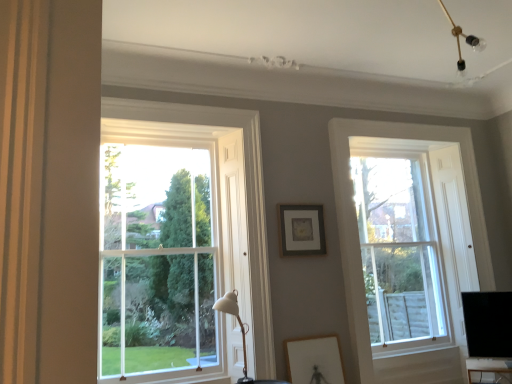
Question: Considering the relative positions of clear glass window at right, the first window positioned from the back, and clear glass window at left, which appears as the 2th window when viewed from the right, in the image provided, is clear glass window at right, the first window positioned from the back, to the right of clear glass window at left, which appears as the 2th window when viewed from the right, from the viewer's perspective?

Choices:
 (A) no
 (B) yes

Answer: (B)

Question: Considering the relative sizes of clear glass window at right, which is the 2th window in front-to-back order, and clear glass window at left, which appears as the 2th window when viewed from the right, in the image provided, is clear glass window at right, which is the 2th window in front-to-back order, shorter than clear glass window at left, which appears as the 2th window when viewed from the right,?

Choices:
 (A) yes
 (B) no

Answer: (B)

Question: Is the depth of clear glass window at right, the 1th window in the right-to-left sequence, less than that of clear glass window at left, which appears as the 2th window when viewed from the right?

Choices:
 (A) yes
 (B) no

Answer: (B)

Question: Is the depth of clear glass window at right, the first window positioned from the back, greater than that of clear glass window at left, which appears as the 2th window when viewed from the right?

Choices:
 (A) yes
 (B) no

Answer: (A)

Question: Is clear glass window at right, which is the 2th window in front-to-back order, oriented away from clear glass window at left, which is the first window in front-to-back order?

Choices:
 (A) yes
 (B) no

Answer: (B)

Question: Is clear glass window at left, which appears as the first window when viewed from the left, inside clear glass window at right, which is the 2th window in front-to-back order?

Choices:
 (A) no
 (B) yes

Answer: (A)

Question: From a real-world perspective, is clear glass window at left, positioned as the 2th window in back-to-front order, physically above matte black picture frame at center, the first picture frame in the top-to-bottom sequence?

Choices:
 (A) no
 (B) yes

Answer: (A)

Question: Does clear glass window at left, which appears as the 2th window when viewed from the right, have a greater width compared to matte black picture frame at center, marked as the second picture frame in a front-to-back arrangement?

Choices:
 (A) yes
 (B) no

Answer: (A)

Question: Is clear glass window at left, which appears as the first window when viewed from the left, aimed at matte black picture frame at center, the first picture frame positioned from the back?

Choices:
 (A) yes
 (B) no

Answer: (B)

Question: Does clear glass window at left, which appears as the first window when viewed from the left, have a lesser height compared to matte black picture frame at center, marked as the second picture frame in a front-to-back arrangement?

Choices:
 (A) no
 (B) yes

Answer: (A)

Question: From the image's perspective, is clear glass window at left, which appears as the 2th window when viewed from the right, over matte black picture frame at center, marked as the second picture frame in a front-to-back arrangement?

Choices:
 (A) no
 (B) yes

Answer: (A)

Question: Can you confirm if clear glass window at left, which appears as the 2th window when viewed from the right, is positioned to the right of matte black picture frame at center, the first picture frame positioned from the back?

Choices:
 (A) no
 (B) yes

Answer: (A)

Question: Is black glossy monitor at lower right to the left of wooden framed picture at lower center, the 1th picture frame when ordered from front to back, from the viewer's perspective?

Choices:
 (A) yes
 (B) no

Answer: (B)